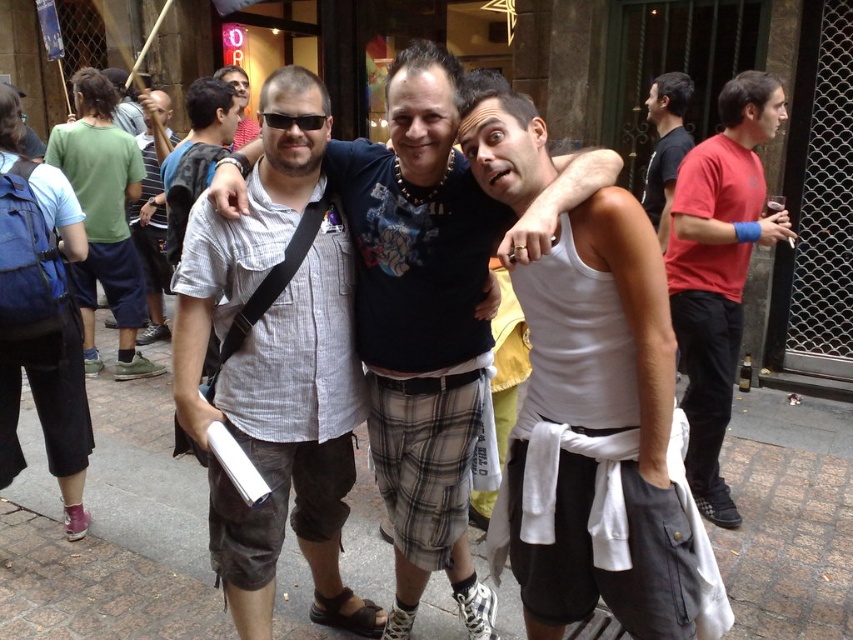
You are a photographer standing in the street scene. You notice the white matte tank top at center and the brown brick pavement at center. Which object is closer to you?

The white matte tank top at center is positioned over the brown brick pavement at center, so the white matte tank top at center is closer to you.

You are a photographer trying to capture a clear shot of the white matte tank top at center and the brown brick pavement at center. Which object should you focus on first if you want to ensure both are in focus?

The white matte tank top at center is taller than the brown brick pavement at center, so you should focus on the white matte tank top at center first to ensure both are in focus.